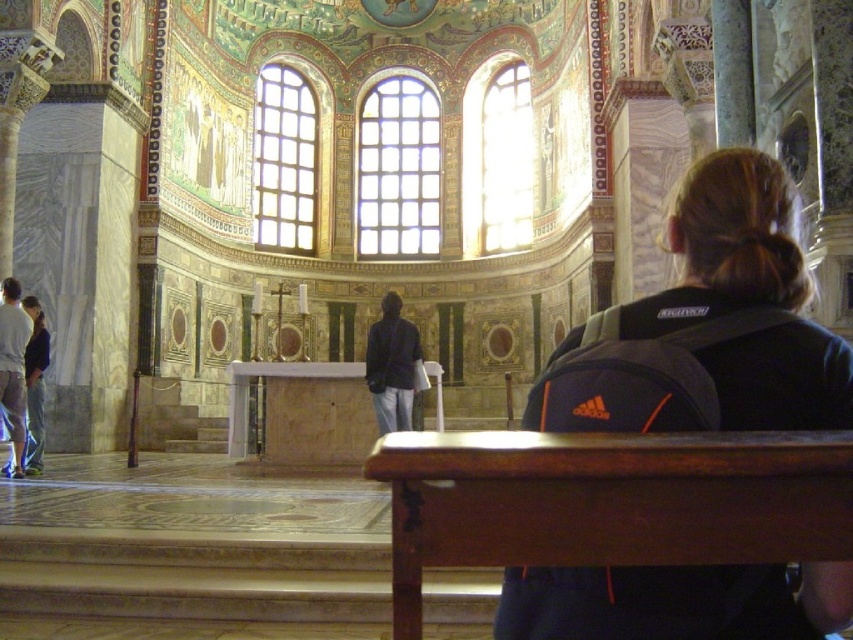
You are standing in the grand cathedral and see the point marked at coordinates (303, 412). Based on the scene description, what object is located at that point?

The point at coordinates (303, 412) corresponds to the smooth marble altar at center.